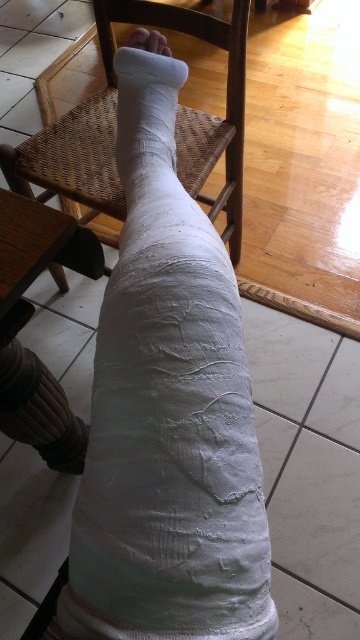
Question: Which object appears farthest from the camera in this image?

Choices:
 (A) woven wood chair at center
 (B) white matte plaster bandage at lower center

Answer: (A)

Question: Among these objects, which one is nearest to the camera?

Choices:
 (A) white matte plaster bandage at lower center
 (B) woven wood chair at center

Answer: (A)

Question: In this image, where is white matte plaster bandage at lower center located relative to woven wood chair at center?

Choices:
 (A) above
 (B) below

Answer: (B)

Question: Is white matte plaster bandage at lower center bigger than woven wood chair at center?

Choices:
 (A) no
 (B) yes

Answer: (A)

Question: Does white matte plaster bandage at lower center have a greater width compared to woven wood chair at center?

Choices:
 (A) no
 (B) yes

Answer: (A)